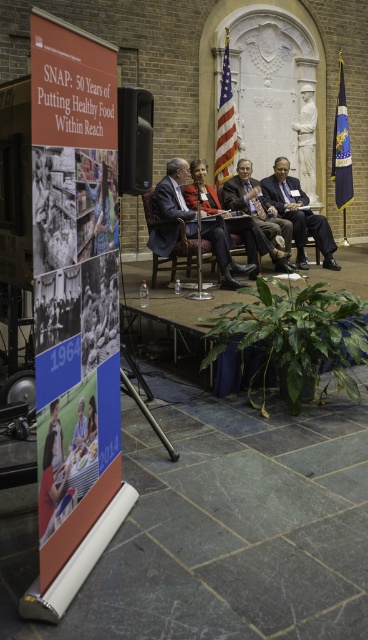
In the scene shown: Measure the distance between orange matte poster at left and camera.

orange matte poster at left and camera are 1.63 meters apart.

I want to click on orange matte poster at left, so click(x=76, y=262).

Find the location of a particular element. This screenshot has height=640, width=368. orange matte poster at left is located at coordinates (76, 262).

Measure the distance between point (249,188) and camera.

Point (249,188) and camera are 23.01 feet apart.

Does point (243, 193) come behind point (154, 284)?

Yes.

The width and height of the screenshot is (368, 640). What do you see at coordinates (257, 211) in the screenshot? I see `dark gray suit at center` at bounding box center [257, 211].

Identify the location of dark gray suit at center. (257, 211).

Who is positioned more to the left, dark blue suit at center or wooden chair at center?

wooden chair at center

Find the location of a particular element. The height and width of the screenshot is (640, 368). dark blue suit at center is located at coordinates click(x=298, y=212).